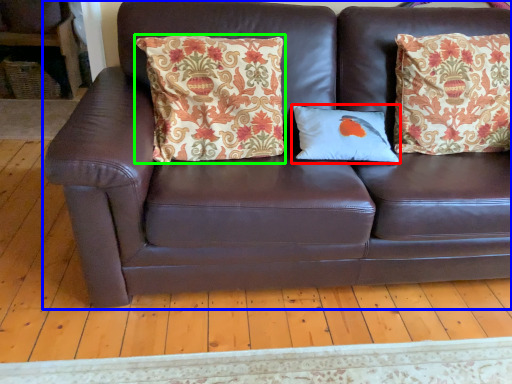
Question: Estimate the real-world distances between objects in this image. Which object is closer to pillow (highlighted by a red box), studio couch (highlighted by a blue box) or pillow (highlighted by a green box)?

Choices:
 (A) studio couch
 (B) pillow

Answer: (B)